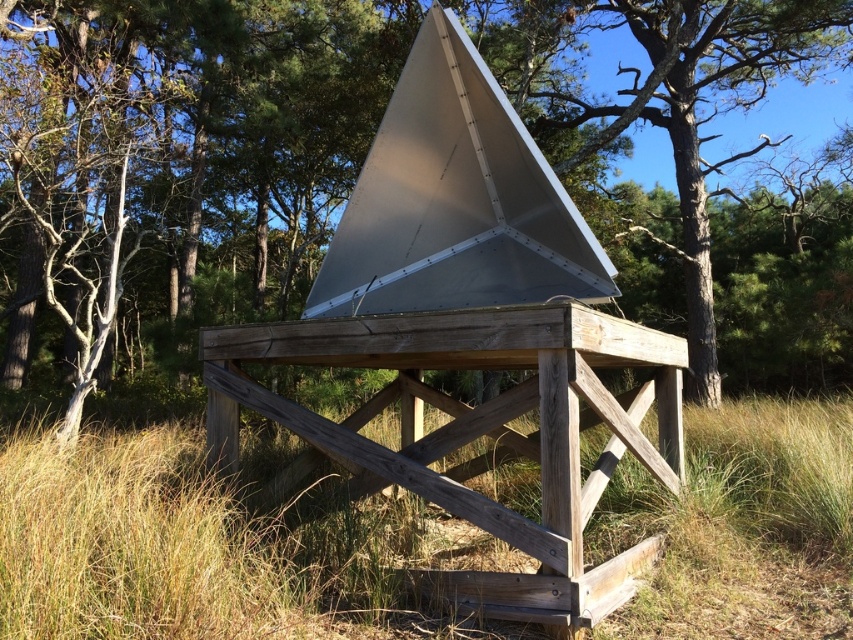
Does matte silver pyramid at center have a greater width compared to wooden picnic table at center?

Indeed, matte silver pyramid at center has a greater width compared to wooden picnic table at center.

Is point (30, 237) closer to camera compared to point (410, 385)?

No, it is behind (410, 385).

Identify the location of matte silver pyramid at center. The height and width of the screenshot is (640, 853). (399, 177).

I want to click on matte silver pyramid at center, so click(399, 177).

Is point (279, 605) behind point (527, 324)?

No, (279, 605) is in front of (527, 324).

Can you confirm if brown grass at lower center is thinner than wooden picnic table at center?

Yes.

Is point (786, 435) farther from camera compared to point (677, 440)?

Yes, point (786, 435) is farther from viewer.

I want to click on brown grass at lower center, so tap(207, 548).

Who is lower down, matte silver pyramid at center or brown grass at lower center?

brown grass at lower center is below.

Does matte silver pyramid at center appear under brown grass at lower center?

Incorrect, matte silver pyramid at center is not positioned below brown grass at lower center.

Who is more forward, (131, 88) or (786, 529)?

Point (786, 529)

This screenshot has height=640, width=853. In order to click on matte silver pyramid at center in this screenshot , I will do `click(399, 177)`.